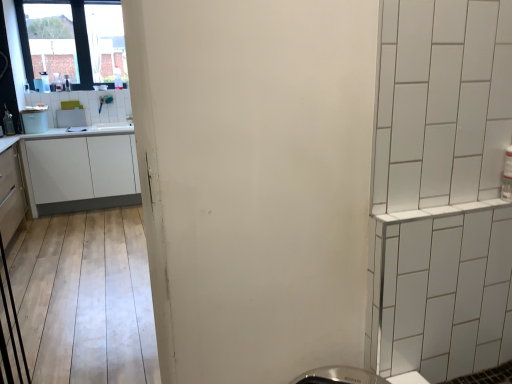
Question: Considering the relative sizes of white glossy trash can at left, the 2th appliance in the back-to-front sequence, and white matte cabinet at left, the second cabinetry viewed from the front, in the image provided, is white glossy trash can at left, the 2th appliance in the back-to-front sequence, smaller than white matte cabinet at left, the second cabinetry viewed from the front,?

Choices:
 (A) yes
 (B) no

Answer: (A)

Question: Is white glossy trash can at left, which appears as the first appliance when viewed from the front, bigger than white matte cabinet at left, positioned as the 1th cabinetry in back-to-front order?

Choices:
 (A) no
 (B) yes

Answer: (A)

Question: Is white glossy trash can at left, which appears as the first appliance when viewed from the front, located outside white matte cabinet at left, positioned as the 1th cabinetry in back-to-front order?

Choices:
 (A) yes
 (B) no

Answer: (A)

Question: Does white glossy trash can at left, which appears as the first appliance when viewed from the front, turn towards white matte cabinet at left, positioned as the 1th cabinetry in back-to-front order?

Choices:
 (A) yes
 (B) no

Answer: (B)

Question: Does white glossy trash can at left, which appears as the first appliance when viewed from the front, have a lesser width compared to white matte cabinet at left, the second cabinetry viewed from the front?

Choices:
 (A) yes
 (B) no

Answer: (A)

Question: Can you see white glossy trash can at left, which appears as the first appliance when viewed from the front, touching white matte cabinet at left, positioned as the 1th cabinetry in back-to-front order?

Choices:
 (A) no
 (B) yes

Answer: (A)

Question: Could you tell me if matte white cabinet at left, the 1th cabinetry viewed from the front, is turned towards transparent glass window at upper left?

Choices:
 (A) no
 (B) yes

Answer: (A)

Question: From the image's perspective, is matte white cabinet at left, the 1th cabinetry viewed from the front, on top of transparent glass window at upper left?

Choices:
 (A) yes
 (B) no

Answer: (B)

Question: Does matte white cabinet at left, the 1th cabinetry viewed from the front, have a greater height compared to transparent glass window at upper left?

Choices:
 (A) no
 (B) yes

Answer: (A)

Question: Is the position of matte white cabinet at left, the 1th cabinetry viewed from the front, more distant than that of transparent glass window at upper left?

Choices:
 (A) yes
 (B) no

Answer: (B)

Question: Does matte white cabinet at left, which is counted as the 2th cabinetry, starting from the back, have a larger size compared to transparent glass window at upper left?

Choices:
 (A) yes
 (B) no

Answer: (A)

Question: Is matte white cabinet at left, which is counted as the 2th cabinetry, starting from the back, next to transparent glass window at upper left?

Choices:
 (A) no
 (B) yes

Answer: (A)

Question: Does transparent glass window at upper left lie behind white glossy microwave at upper left, which is counted as the 1th appliance, starting from the back?

Choices:
 (A) yes
 (B) no

Answer: (B)